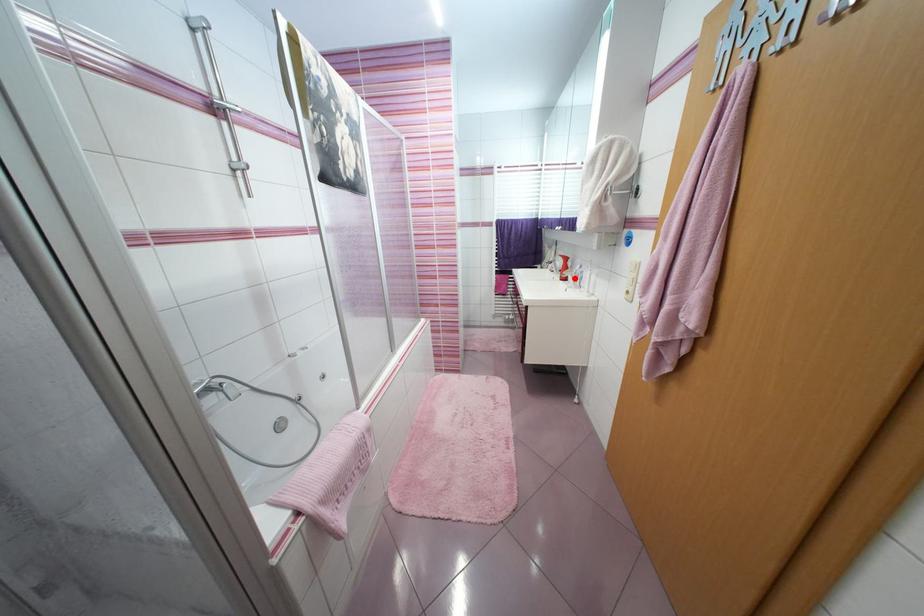
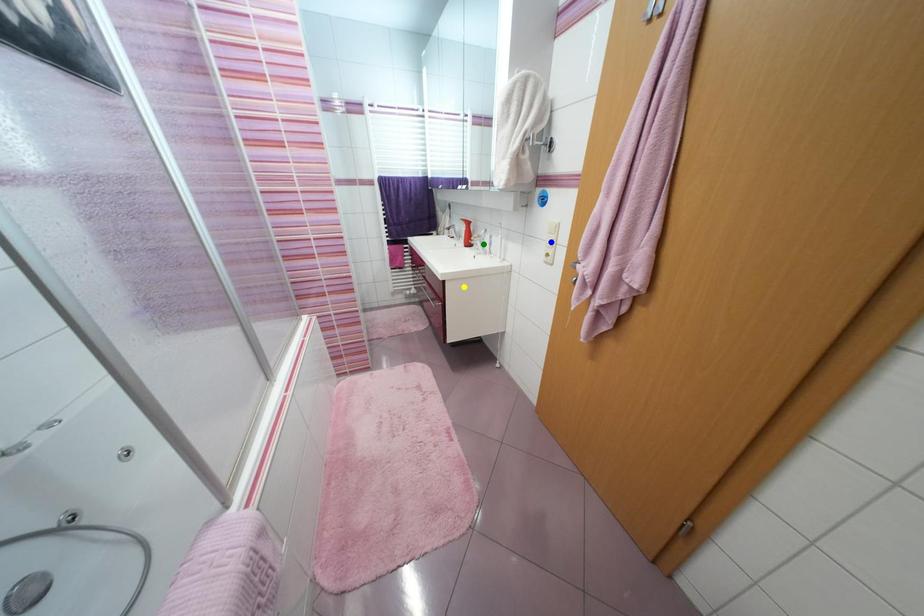
Question: I am providing you with two images of the same scene from different viewpoints. A red point is marked on the first image. You are given multiple points on the second image. Which spot in image 2 lines up with the point in image 1?

Choices:
 (A) green point
 (B) blue point
 (C) yellow point

Answer: (A)